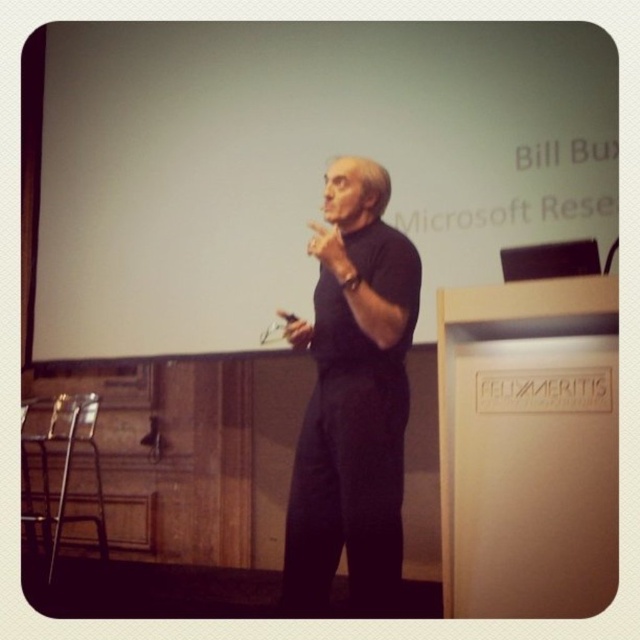
Question: Is white matte projection screen at upper left to the right of black matte shirt at center from the viewer's perspective?

Choices:
 (A) no
 (B) yes

Answer: (A)

Question: Which object appears closest to the camera in this image?

Choices:
 (A) white matte projection screen at upper left
 (B) black matte shirt at center

Answer: (B)

Question: Which point is closer to the camera?

Choices:
 (A) white matte projection screen at upper left
 (B) black matte shirt at center

Answer: (B)

Question: Does white matte projection screen at upper left appear over black matte shirt at center?

Choices:
 (A) yes
 (B) no

Answer: (A)

Question: Can you confirm if white matte projection screen at upper left is positioned above black matte shirt at center?

Choices:
 (A) yes
 (B) no

Answer: (A)